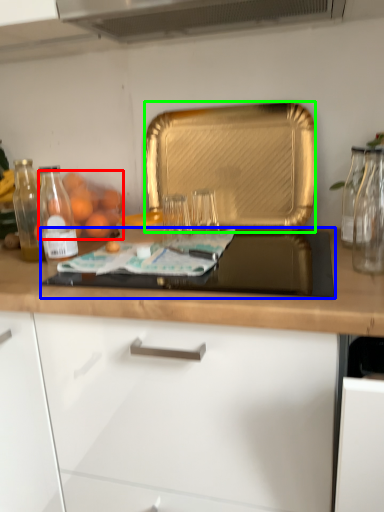
Question: Which object is the farthest from fruit (highlighted by a red box)? Choose among these: gas stove (highlighted by a blue box) or kitchen appliance (highlighted by a green box).

Choices:
 (A) gas stove
 (B) kitchen appliance

Answer: (A)